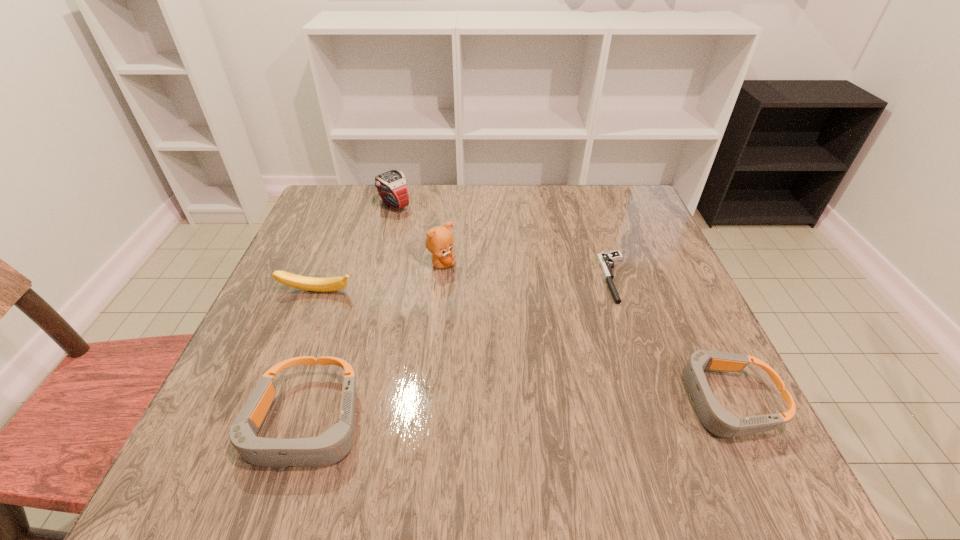
The width and height of the screenshot is (960, 540). In the image, there is a desktop. In order to click on vacant space at the far left corner in this screenshot , I will do click(340, 196).

Locate an element on the screen. This screenshot has width=960, height=540. free space between the rightmost object and the second object from right to left is located at coordinates (671, 339).

You are a GUI agent. You are given a task and a screenshot of the screen. Output one action in this format:
    pyautogui.click(x=<x>, y=<y>)
    Task: Click on the empty space that is in between the fifth object from left to right and the tallest object
    This screenshot has height=540, width=960.
    Given the screenshot: What is the action you would take?
    pyautogui.click(x=528, y=271)

What are the coordinates of `vacant space in between the watch and the tallest object` in the screenshot? It's located at (418, 234).

Locate an element on the screen. Image resolution: width=960 pixels, height=540 pixels. free space between the fifth shortest object and the teddy bear is located at coordinates (418, 234).

At what (x,y) coordinates should I click in order to perform the action: click on vacant space that is in between the right goggles and the tallest object. Please return your answer as a coordinate pair (x, y). The height and width of the screenshot is (540, 960). Looking at the image, I should click on (584, 333).

Find the location of a particular element. free spot between the pistol and the banana is located at coordinates (467, 285).

This screenshot has width=960, height=540. What are the coordinates of `vacant space that's between the fifth object from left to right and the farthest object` in the screenshot? It's located at (505, 241).

Locate an element on the screen. This screenshot has height=540, width=960. vacant space that's between the taller goggles and the shortest object is located at coordinates (461, 351).

Locate an element on the screen. This screenshot has width=960, height=540. free area in between the second shortest object and the banana is located at coordinates (522, 346).